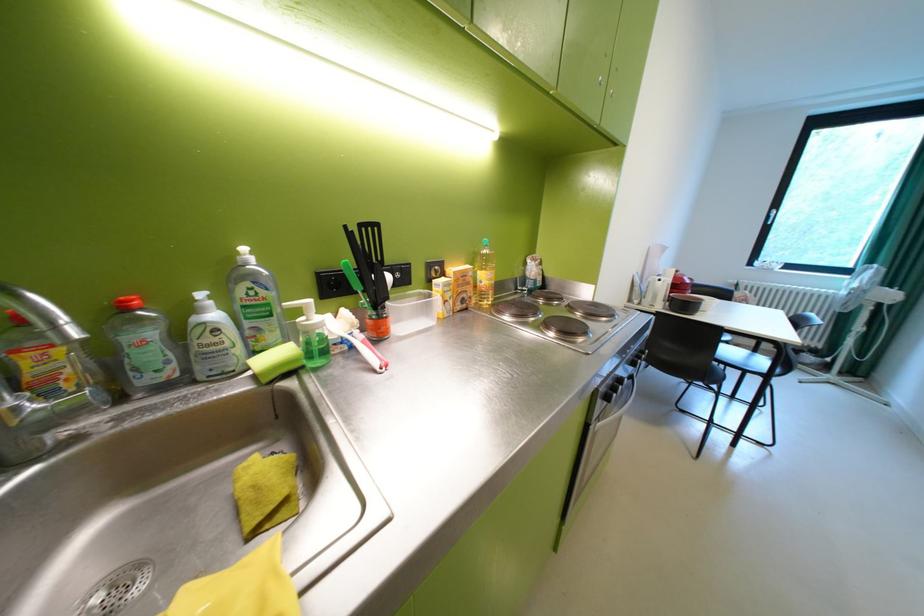
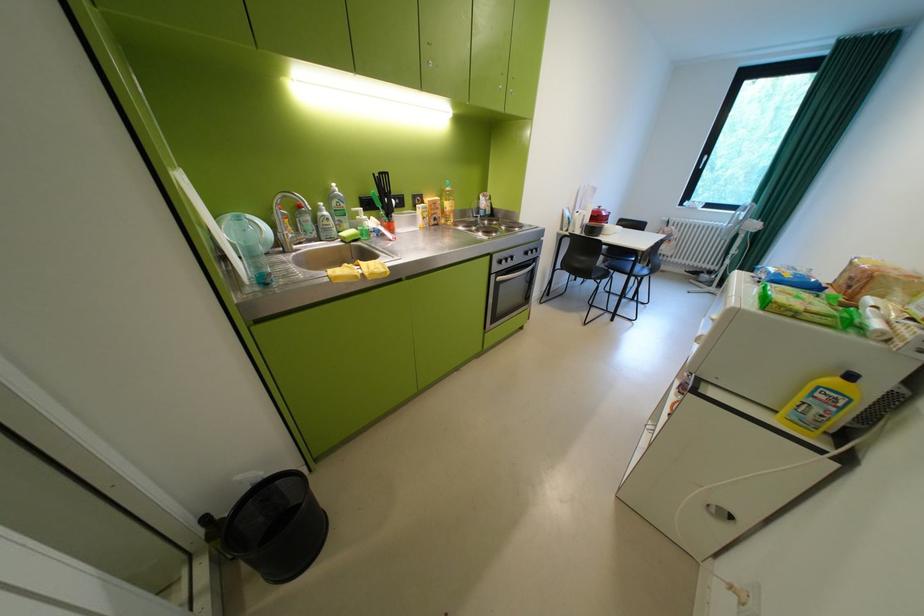
Locate, in the second image, the point that corresponds to point 640,302 in the first image.

(572, 230)